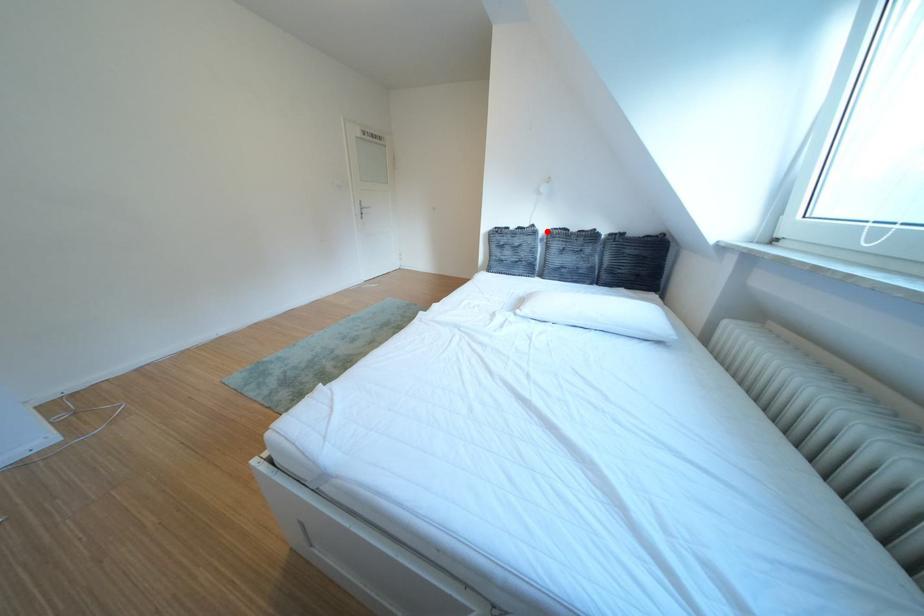
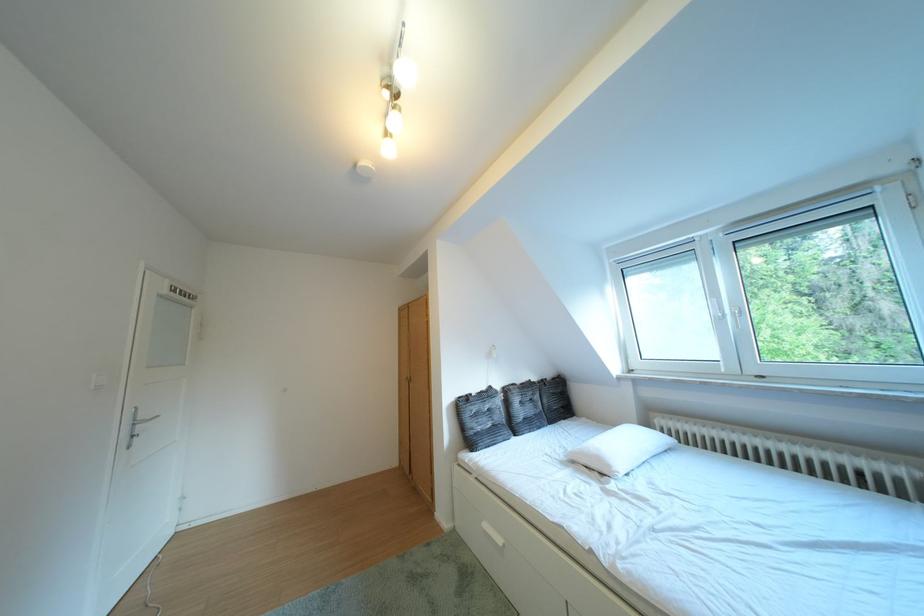
In the second image, find the point that corresponds to the highlighted location in the first image.

(504, 392)